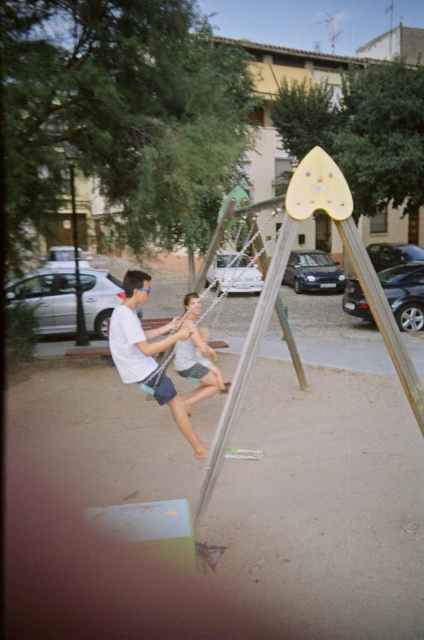
Between point (226, 209) and point (81, 342), which one is positioned in front?

Point (226, 209) is in front.

Where is `wooden swing at center`? wooden swing at center is located at coordinates (214, 241).

Who is higher up, light blue denim shorts at center or wooden swing at center?

A: Positioned higher is wooden swing at center.

Is point (197, 332) positioned before point (243, 211)?

No, (197, 332) is behind (243, 211).

I want to click on light blue denim shorts at center, so click(198, 365).

How distant is white cotton shirt at center from brushed metal pole at left?

The distance of white cotton shirt at center from brushed metal pole at left is 6.48 meters.

Find the location of `white cotton shirt at center`. white cotton shirt at center is located at coordinates (148, 353).